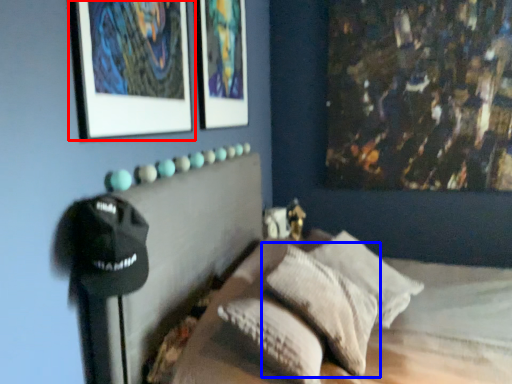
Question: Which point is further to the camera, picture frame (highlighted by a red box) or pillow (highlighted by a blue box)?

Choices:
 (A) picture frame
 (B) pillow

Answer: (B)